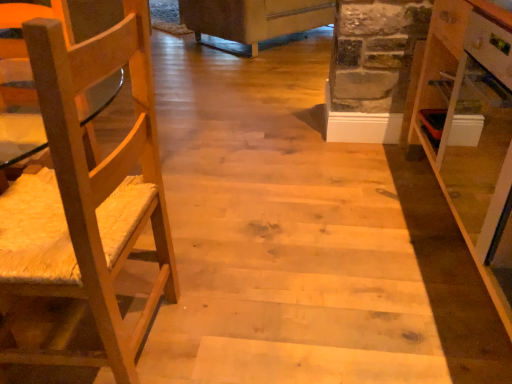
Question: Can you confirm if natural wood chair at left is thinner than white fabric couch at upper center?

Choices:
 (A) no
 (B) yes

Answer: (B)

Question: Is natural wood chair at left further to camera compared to white fabric couch at upper center?

Choices:
 (A) no
 (B) yes

Answer: (A)

Question: Is natural wood chair at left aimed at white fabric couch at upper center?

Choices:
 (A) no
 (B) yes

Answer: (A)

Question: Is natural wood chair at left taller than white fabric couch at upper center?

Choices:
 (A) yes
 (B) no

Answer: (A)

Question: Is natural wood chair at left bigger than white fabric couch at upper center?

Choices:
 (A) no
 (B) yes

Answer: (A)

Question: Is natural wood chair at left wider or thinner than white fabric couch at upper center?

Choices:
 (A) thin
 (B) wide

Answer: (A)

Question: Would you say natural wood chair at left is to the left or to the right of white fabric couch at upper center in the picture?

Choices:
 (A) right
 (B) left

Answer: (B)

Question: Is natural wood chair at left taller or shorter than white fabric couch at upper center?

Choices:
 (A) short
 (B) tall

Answer: (B)

Question: Relative to white fabric couch at upper center, is natural wood chair at left in front or behind?

Choices:
 (A) behind
 (B) front

Answer: (B)

Question: From the image's perspective, is white glossy cabinet at right above or below white fabric couch at upper center?

Choices:
 (A) above
 (B) below

Answer: (B)

Question: In the image, is white glossy cabinet at right positioned in front of or behind white fabric couch at upper center?

Choices:
 (A) behind
 (B) front

Answer: (B)

Question: Is white glossy cabinet at right inside the boundaries of white fabric couch at upper center, or outside?

Choices:
 (A) outside
 (B) inside

Answer: (A)

Question: Is point (509, 39) positioned closer to the camera than point (293, 1)?

Choices:
 (A) closer
 (B) farther

Answer: (A)

Question: From the image's perspective, is white fabric couch at upper center above or below white glossy cabinet at right?

Choices:
 (A) above
 (B) below

Answer: (A)

Question: In terms of size, does white fabric couch at upper center appear bigger or smaller than white glossy cabinet at right?

Choices:
 (A) small
 (B) big

Answer: (B)